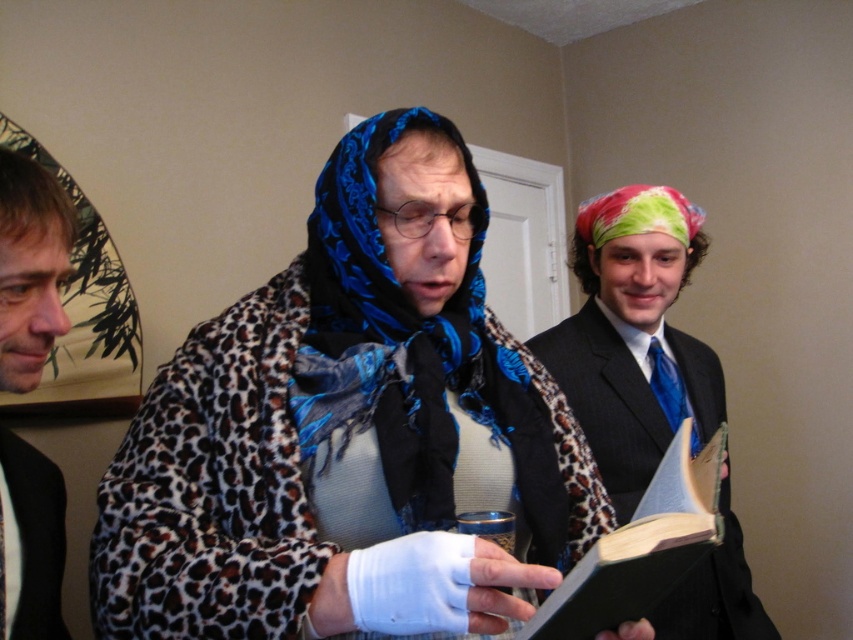
Measure the distance from smooth brown hair at left to blonde hair at left.

smooth brown hair at left and blonde hair at left are 6.61 inches apart.

Is smooth brown hair at left positioned behind blonde hair at left?

That is False.

Who is more forward, (33, 348) or (44, 225)?

Positioned in front is point (44, 225).

Identify the location of smooth brown hair at left. (30, 268).

Is blue printed scarf at center smaller than black satin business suit at left?

Actually, blue printed scarf at center might be larger than black satin business suit at left.

Is point (392, 291) farther from camera compared to point (61, 484)?

No, (392, 291) is closer to viewer.

Is point (363, 173) farther from viewer compared to point (65, 632)?

Yes.

Locate an element on the screen. blue printed scarf at center is located at coordinates (421, 356).

How distant is blue printed scarf at center from blonde hair at left?

17.04 inches

The image size is (853, 640). What do you see at coordinates (421, 356) in the screenshot? I see `blue printed scarf at center` at bounding box center [421, 356].

Is point (379, 445) positioned in front of point (48, 177)?

No.

Locate an element on the screen. blue printed scarf at center is located at coordinates (421, 356).